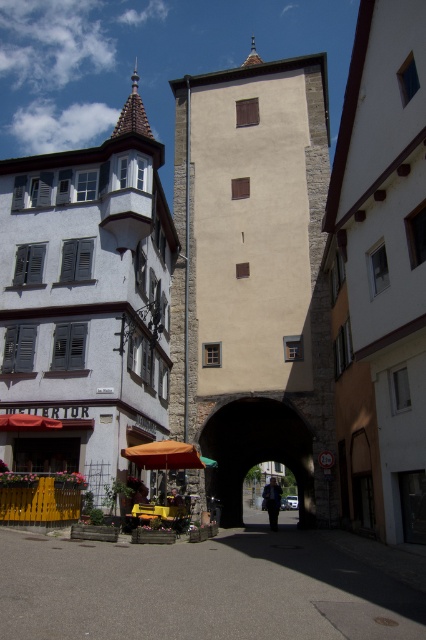
You are a street vendor setting up a stall in the scene. You have two fabrics to choose from for your canopy. The orange fabric umbrella at lower center and the dark blue fabric at center. Which fabric would you choose if you want to cover a larger area?

The dark blue fabric at center would be better for covering a larger area since it occupies more space than the orange fabric umbrella at lower center.

You are an architect designing a new public space and want to incorporate elements similar to the stone archway at center and the orange fabric umbrella at lower center. If you want to maintain the scale relationship seen in the image, which element should be designed to be bigger?

The stone archway at center should be designed to be bigger since it has a larger size compared to the orange fabric umbrella at lower center in the image.